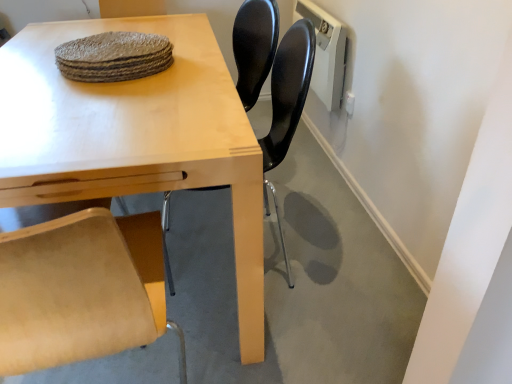
In order to click on free spot above light wood table at center (from a real-world perspective) in this screenshot , I will do click(x=87, y=86).